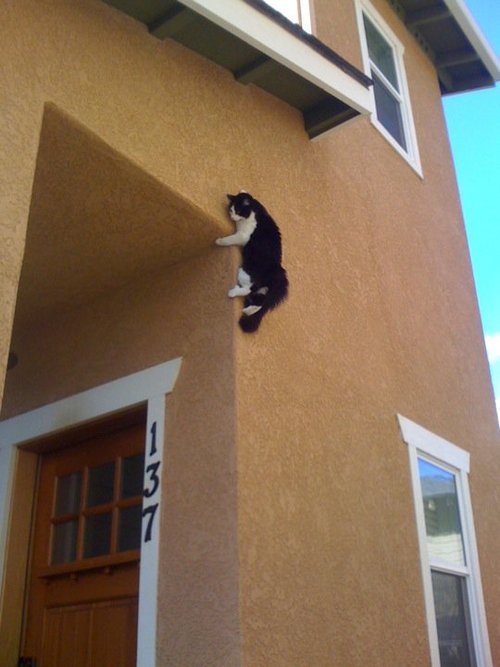
Where is `stucco wall`? stucco wall is located at coordinates click(345, 366).